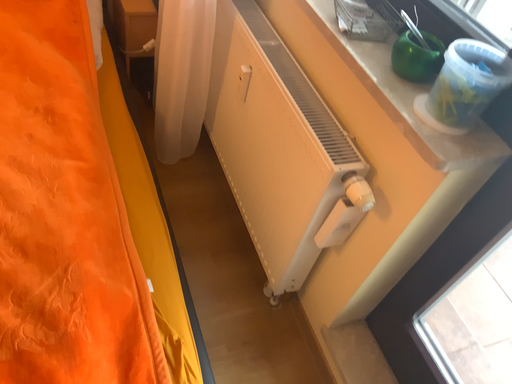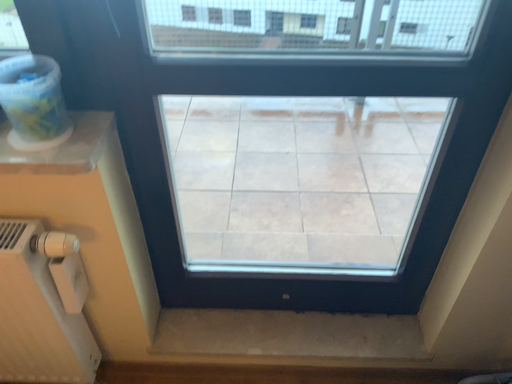
Question: How did the camera likely rotate when shooting the video?

Choices:
 (A) rotated right
 (B) rotated left

Answer: (A)